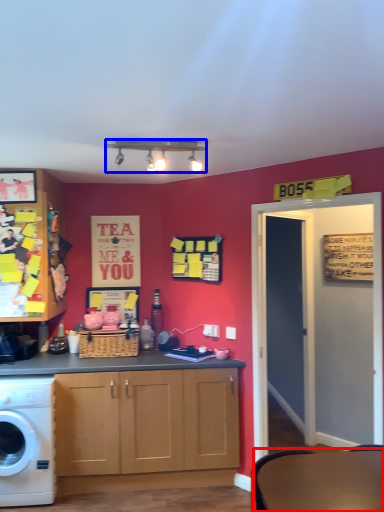
Question: Which object appears closest to the camera in this image, round table (highlighted by a red box) or lamp (highlighted by a blue box)?

Choices:
 (A) round table
 (B) lamp

Answer: (A)